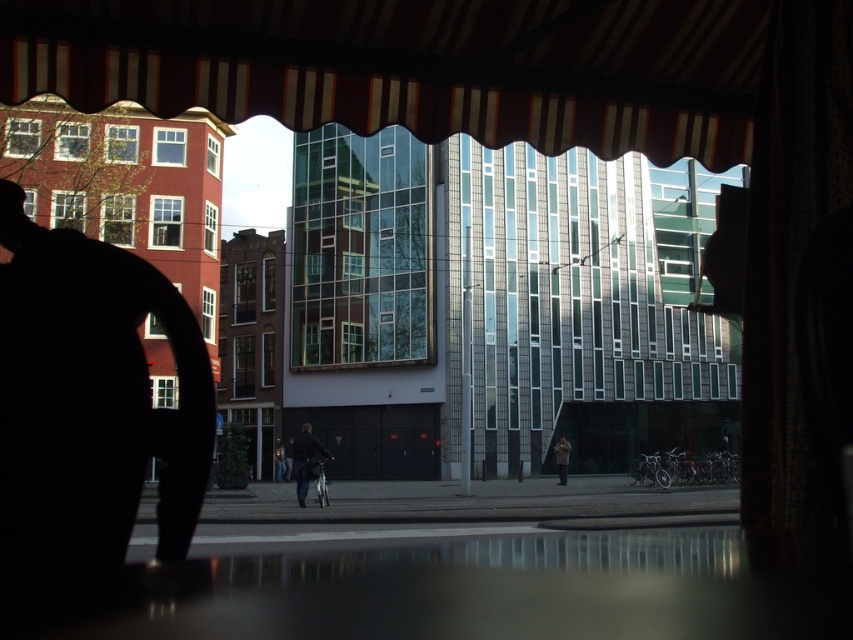
Question: Can you confirm if dark blue jeans at center is wider than light brown leather jacket at center?

Choices:
 (A) yes
 (B) no

Answer: (A)

Question: Is dark blue jeans at center to the right of light brown leather jacket at center from the viewer's perspective?

Choices:
 (A) no
 (B) yes

Answer: (A)

Question: Which object is closer to the camera taking this photo?

Choices:
 (A) dark blue jeans at center
 (B) light brown leather jacket at center
 (C) striped fabric awning at upper center

Answer: (C)

Question: Among these points, which one is nearest to the camera?

Choices:
 (A) pos(263,90)
 (B) pos(300,506)
 (C) pos(553,449)

Answer: (A)

Question: Is dark blue jeans at center to the left of light brown leather jacket at center from the viewer's perspective?

Choices:
 (A) yes
 (B) no

Answer: (A)

Question: Among these points, which one is farthest from the camera?

Choices:
 (A) (4, 10)
 (B) (310, 467)

Answer: (B)